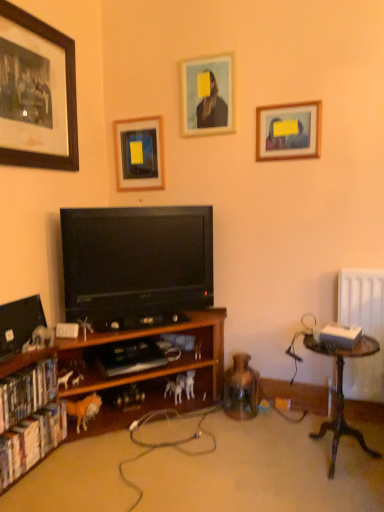
Question: Is black glossy television at center to the right of wooden framed picture at upper right, which is the 1th picture frame from right to left, from the viewer's perspective?

Choices:
 (A) yes
 (B) no

Answer: (B)

Question: Is black glossy television at center bigger than wooden framed picture at upper right, acting as the 4th picture frame starting from the left?

Choices:
 (A) no
 (B) yes

Answer: (B)

Question: Is black glossy television at center shorter than wooden framed picture at upper right, which is the 1th picture frame from right to left?

Choices:
 (A) no
 (B) yes

Answer: (A)

Question: From a real-world perspective, is black glossy television at center located higher than wooden framed picture at upper right, acting as the 4th picture frame starting from the left?

Choices:
 (A) no
 (B) yes

Answer: (A)

Question: Considering the relative sizes of black glossy television at center and wooden framed picture at upper right, which is the 1th picture frame from right to left, in the image provided, is black glossy television at center smaller than wooden framed picture at upper right, which is the 1th picture frame from right to left,?

Choices:
 (A) no
 (B) yes

Answer: (A)

Question: Is white plastic horse at lower left, which appears as the first animal when viewed from the left, inside the boundaries of orange plush horse at lower left, placed as the second animal when sorted from right to left, or outside?

Choices:
 (A) inside
 (B) outside

Answer: (B)

Question: In the image, is white plastic horse at lower left, which ranks as the 3th animal in right-to-left order, on the left side or the right side of orange plush horse at lower left, the 2th animal positioned from the front?

Choices:
 (A) right
 (B) left

Answer: (B)

Question: Is white plastic horse at lower left, which ranks as the 3th animal in right-to-left order, in front of or behind orange plush horse at lower left, acting as the 2th animal starting from the left, in the image?

Choices:
 (A) front
 (B) behind

Answer: (A)

Question: From a real-world perspective, is white plastic horse at lower left, which ranks as the 3th animal in right-to-left order, positioned above or below orange plush horse at lower left, acting as the 2th animal starting from the back?

Choices:
 (A) above
 (B) below

Answer: (A)

Question: Considering the positions of point (185, 125) and point (87, 404), is point (185, 125) closer or farther from the camera than point (87, 404)?

Choices:
 (A) closer
 (B) farther

Answer: (B)

Question: From a real-world perspective, is matte wooden picture frame at upper center, which appears as the third picture frame when viewed from the left, physically located above or below orange plush horse at lower left, acting as the 2th animal starting from the left?

Choices:
 (A) above
 (B) below

Answer: (A)

Question: In terms of width, does matte wooden picture frame at upper center, placed as the 2th picture frame when sorted from right to left, look wider or thinner when compared to orange plush horse at lower left, acting as the 2th animal starting from the back?

Choices:
 (A) thin
 (B) wide

Answer: (A)

Question: Considering the relative positions of matte wooden picture frame at upper center, which appears as the third picture frame when viewed from the left, and orange plush horse at lower left, the 2th animal positioned from the front, in the image provided, is matte wooden picture frame at upper center, which appears as the third picture frame when viewed from the left, to the left or to the right of orange plush horse at lower left, the 2th animal positioned from the front,?

Choices:
 (A) right
 (B) left

Answer: (A)

Question: Does point (9, 7) appear closer or farther from the camera than point (94, 414)?

Choices:
 (A) closer
 (B) farther

Answer: (A)

Question: From a real-world perspective, is matte black picture frame at upper left, which ranks as the first picture frame in left-to-right order, above or below orange plush horse at lower left, acting as the 2th animal starting from the left?

Choices:
 (A) below
 (B) above

Answer: (B)